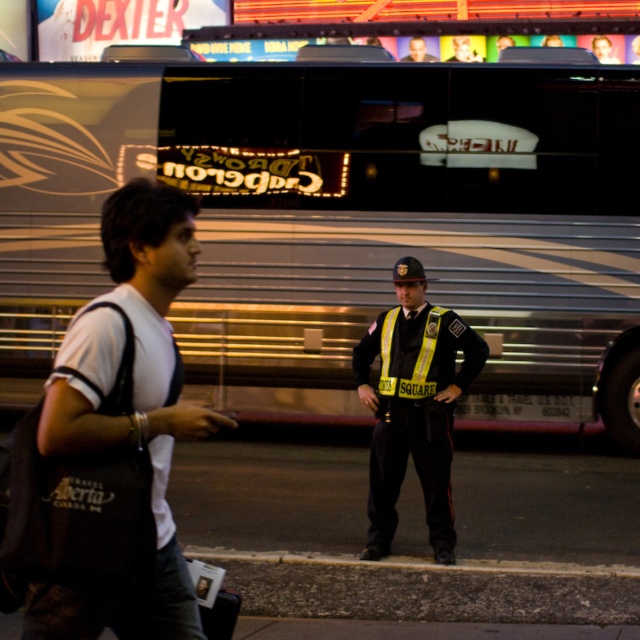
Question: Is the position of brushed metal bus at center less distant than that of gray concrete curb at lower center?

Choices:
 (A) no
 (B) yes

Answer: (A)

Question: Which of the following is the closest to the observer?

Choices:
 (A) (449, 348)
 (B) (612, 58)

Answer: (A)

Question: Can you confirm if brushed metal bus at center is positioned above white t-shirt at center?

Choices:
 (A) yes
 (B) no

Answer: (B)

Question: Which object is closer to the camera taking this photo?

Choices:
 (A) reflective black uniform at center
 (B) dark gray backpack at left
 (C) gray concrete curb at lower center

Answer: (B)

Question: Can you confirm if brushed metal bus at center is positioned above reflective black uniform at center?

Choices:
 (A) no
 (B) yes

Answer: (B)

Question: Among these objects, which one is farthest from the camera?

Choices:
 (A) reflective black uniform at center
 (B) white t-shirt at center
 (C) smooth black uniform at center

Answer: (C)